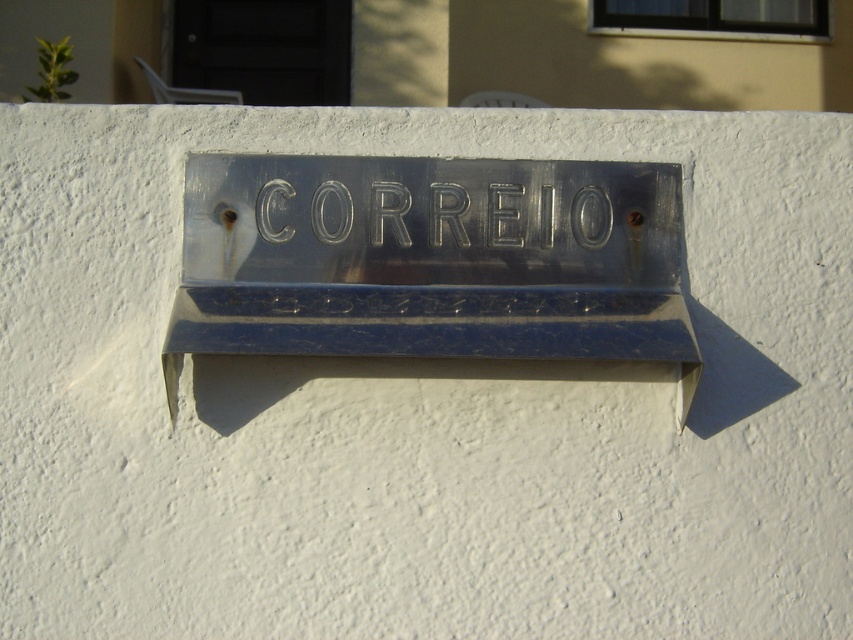
This screenshot has width=853, height=640. Identify the location of metallic blue mailbox at center. (431, 260).

Does metallic blue mailbox at center have a lesser width compared to metallic embossed letters at center?

Incorrect, metallic blue mailbox at center's width is not less than metallic embossed letters at center's.

Between point (247, 275) and point (432, 234), which one is positioned behind?

The point (432, 234) is behind.

What are the coordinates of `metallic blue mailbox at center` in the screenshot? It's located at (431, 260).